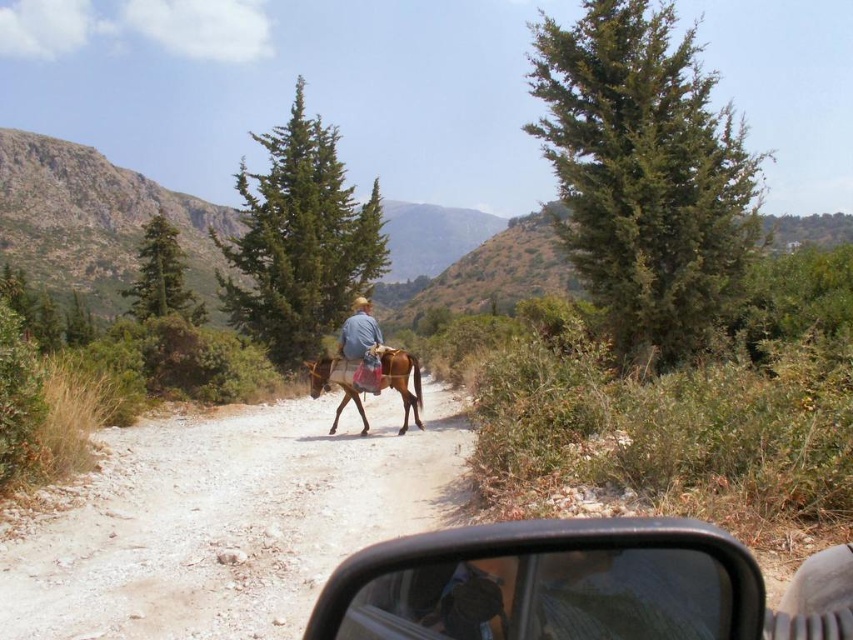
Is brown gravel road at center to the right of green textured pine at center from the viewer's perspective?

Correct, you'll find brown gravel road at center to the right of green textured pine at center.

Does point (154, 556) come in front of point (325, 205)?

Yes, point (154, 556) is in front of point (325, 205).

Describe the element at coordinates (228, 522) in the screenshot. Image resolution: width=853 pixels, height=640 pixels. I see `brown gravel road at center` at that location.

I want to click on brown gravel road at center, so click(228, 522).

Can you confirm if green needle-like pine at upper right is positioned to the left of green textured pine at center?

Incorrect, green needle-like pine at upper right is not on the left side of green textured pine at center.

Measure the distance between point (676, 168) and camera.

Point (676, 168) is 45.39 feet from camera.

Find the location of a particular element. green needle-like pine at upper right is located at coordinates (643, 172).

Is brown glossy horse at center further to camera compared to blue denim jacket at center?

No, brown glossy horse at center is in front of blue denim jacket at center.

Is brown glossy horse at center closer to camera compared to blue denim jacket at center?

Yes.

Which is in front, point (409, 403) or point (344, 348)?

Positioned in front is point (409, 403).

Where is `brown glossy horse at center`? Image resolution: width=853 pixels, height=640 pixels. brown glossy horse at center is located at coordinates [x=335, y=384].